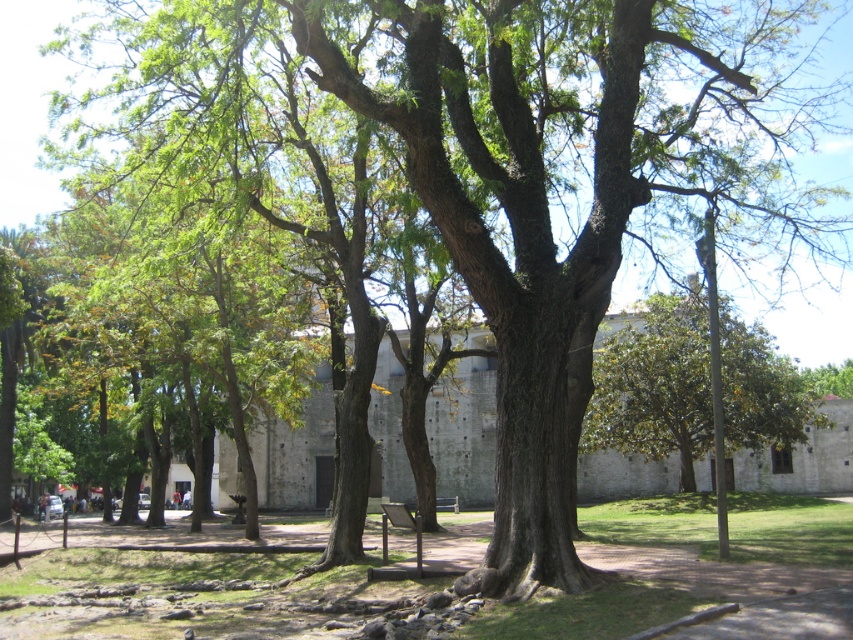
Question: Where is brown rough tree at center located in relation to green leafy tree at center in the image?

Choices:
 (A) left
 (B) right

Answer: (A)

Question: Does brown rough tree at center have a greater width compared to green leafy tree at center?

Choices:
 (A) yes
 (B) no

Answer: (A)

Question: Is the position of brown rough tree at center less distant than that of green leafy tree at center?

Choices:
 (A) no
 (B) yes

Answer: (B)